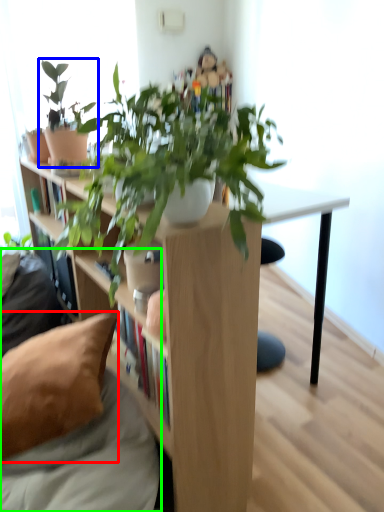
Question: Considering the real-world distances, which object is closest to pillow (highlighted by a red box)? houseplant (highlighted by a blue box) or couch (highlighted by a green box).

Choices:
 (A) houseplant
 (B) couch

Answer: (B)